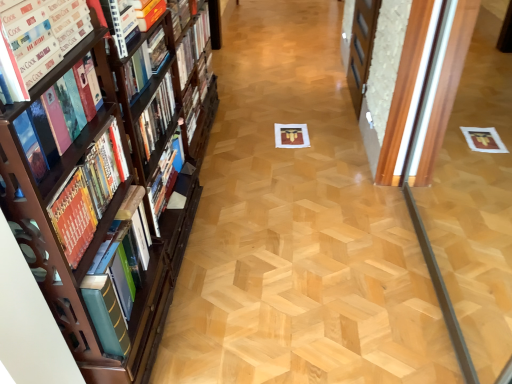
Question: Is hardcover book at upper center, positioned as the first book in back-to-front order, a part of matte hardcover book at left, marked as the fifth book in a back-to-front arrangement?

Choices:
 (A) no
 (B) yes

Answer: (A)

Question: Is matte hardcover book at left, which is the second book in front-to-back order, to the left of hardcover book at upper center, positioned as the first book in back-to-front order, from the viewer's perspective?

Choices:
 (A) no
 (B) yes

Answer: (B)

Question: Does matte hardcover book at left, which is the second book in front-to-back order, turn towards hardcover book at upper center, acting as the 6th book starting from the front?

Choices:
 (A) no
 (B) yes

Answer: (A)

Question: Is matte hardcover book at left, marked as the fifth book in a back-to-front arrangement, further to camera compared to hardcover book at upper center, positioned as the first book in back-to-front order?

Choices:
 (A) yes
 (B) no

Answer: (B)

Question: Does matte hardcover book at left, marked as the fifth book in a back-to-front arrangement, have a smaller size compared to hardcover book at upper center, acting as the 6th book starting from the front?

Choices:
 (A) yes
 (B) no

Answer: (B)

Question: From a real-world perspective, is matte hardcover book at left, marked as the fifth book in a back-to-front arrangement, physically below hardcover book at upper center, positioned as the first book in back-to-front order?

Choices:
 (A) no
 (B) yes

Answer: (A)

Question: Can you confirm if hardcover book at left, which is counted as the 4th book, starting from the back, is taller than hardcover book at left, the third book viewed from the back?

Choices:
 (A) yes
 (B) no

Answer: (B)

Question: Could you tell me if hardcover book at left, placed as the 3th book when sorted from front to back, is facing hardcover book at left, which is the 4th book from front to back?

Choices:
 (A) no
 (B) yes

Answer: (A)

Question: Considering the relative sizes of hardcover book at left, which is counted as the 4th book, starting from the back, and hardcover book at left, which is the 4th book from front to back, in the image provided, is hardcover book at left, which is counted as the 4th book, starting from the back, smaller than hardcover book at left, which is the 4th book from front to back,?

Choices:
 (A) no
 (B) yes

Answer: (A)

Question: Is hardcover book at left, placed as the 3th book when sorted from front to back, bigger than hardcover book at left, which is the 4th book from front to back?

Choices:
 (A) no
 (B) yes

Answer: (B)

Question: Can we say hardcover book at left, placed as the 3th book when sorted from front to back, lies outside hardcover book at left, which is the 4th book from front to back?

Choices:
 (A) yes
 (B) no

Answer: (A)

Question: Would you say hardcover book at left, placed as the 3th book when sorted from front to back, contains hardcover book at left, which is the 4th book from front to back?

Choices:
 (A) no
 (B) yes

Answer: (A)

Question: Does wooden screen door at right come in front of matte hardcover book at left, marked as the fifth book in a back-to-front arrangement?

Choices:
 (A) no
 (B) yes

Answer: (A)